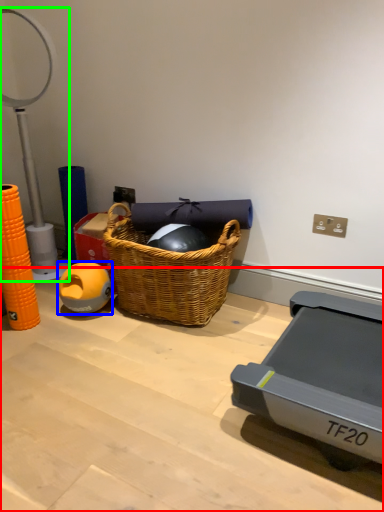
Question: Which is nearer to the table (highlighted by a red box)? ball (highlighted by a blue box) or table lamp (highlighted by a green box).

Choices:
 (A) ball
 (B) table lamp

Answer: (A)